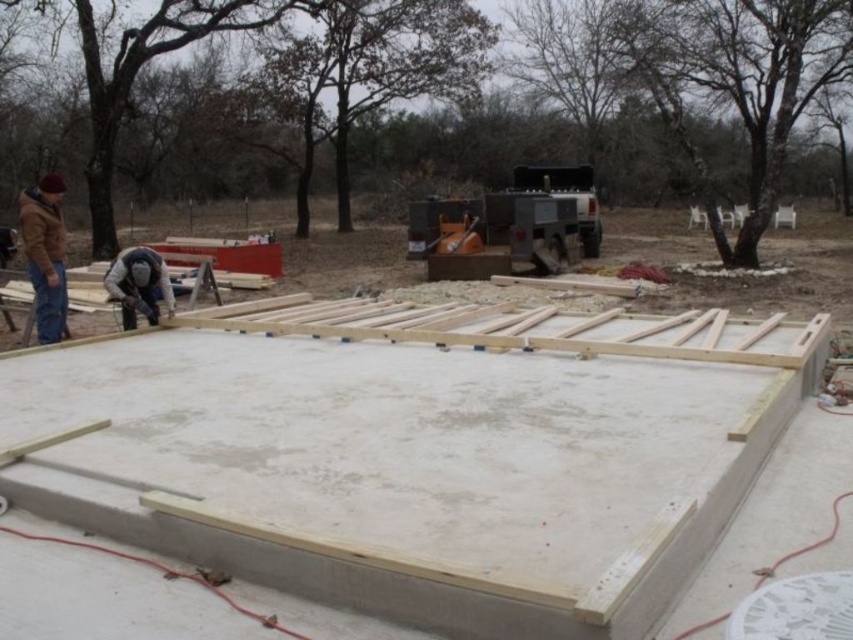
Can you confirm if light brown wood at center is smaller than brown leather jacket at left?

Yes.

Is light brown wood at center below brown leather jacket at left?

Correct, light brown wood at center is located below brown leather jacket at left.

Who is more forward, [494,557] or [41,209]?

Point [494,557]

Where is `light brown wood at center`? Image resolution: width=853 pixels, height=640 pixels. light brown wood at center is located at coordinates (427, 470).